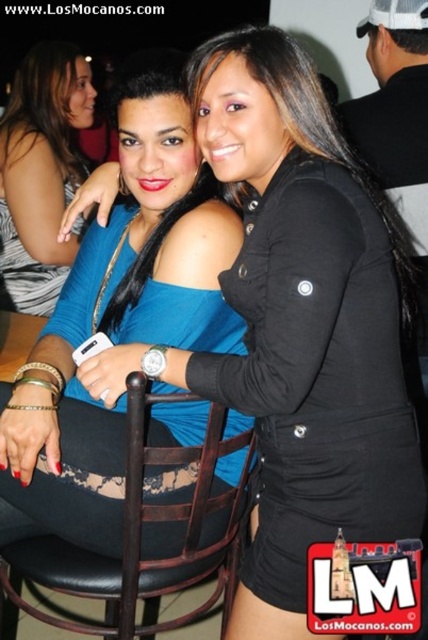
You are standing in front of the two women at the event. You notice two points marked on the image, one at coordinates point (74, 422) and the other at point (36, 49). Which of these two points is nearer to your viewpoint?

Point (74, 422) is closer to the camera than point (36, 49), so the point at coordinates point (74, 422) is nearer to your viewpoint.

You are at a fashion show and need to describe the outfit of the woman in the center. Which item is positioned lower on her body between the blue matte dress at center and the blue fabric top at center?

The blue matte dress at center is positioned lower than the blue fabric top at center, so the blue matte dress at center is the item that is lower on her body.

You are standing in front of the two women at the event. You notice two points marked in the image. The first point is at coordinate point (65,579) and the second is at point (91,88). Which of these two points is nearer to you?

Point (65,579) is closer to the viewer than point (91,88).